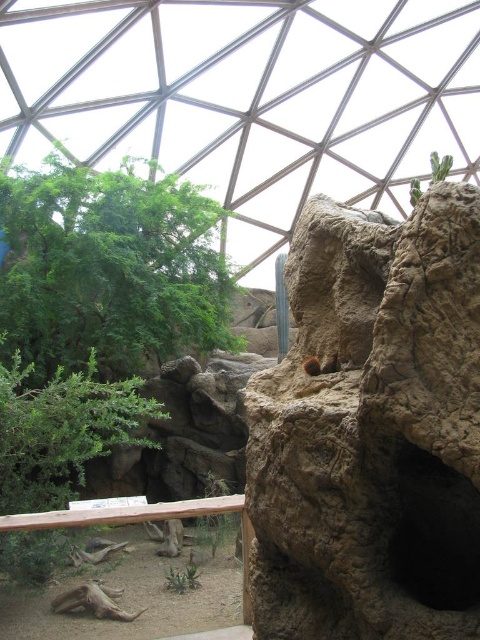
You are standing inside the geodesic dome and want to take a photo of both green leafy tree at upper left and green leafy tree at lower left. Which tree should you focus on first to ensure both are in the frame?

You should focus on the green leafy tree at upper left first because it is closer to you than the green leafy tree at lower left, so adjusting the camera to include both would require framing from the closer one outward.